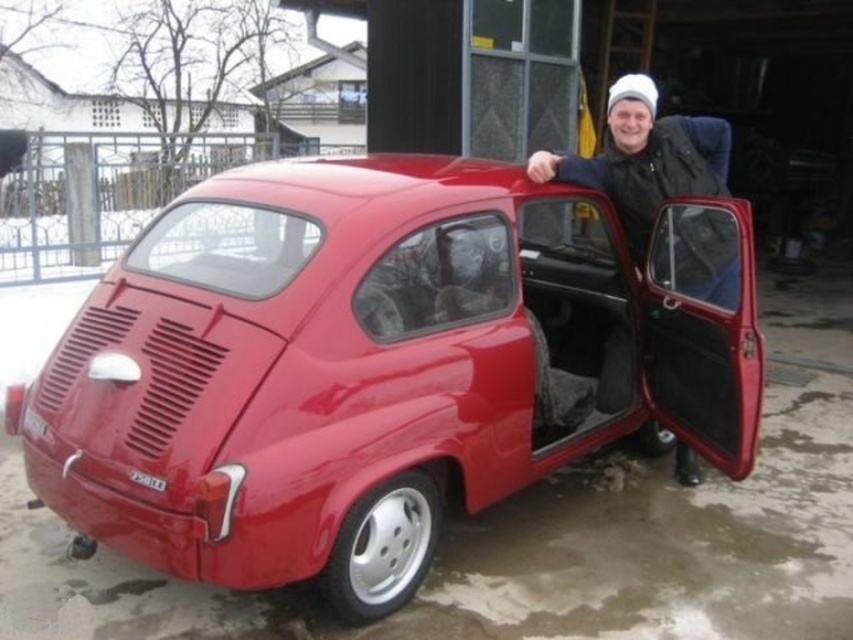
You are a delivery person trying to park your van in the residential area shown. The parking spot is at coordinates 0.6, 0.4. Is the glossy red car at center blocking your parking spot?

The glossy red car at center is located at point (378, 365), which is very close to the parking spot at (340, 384). Depending on the exact dimensions and orientation of the car and parking spot, it might be blocking access. However, since the car is parked and you can maneuver around it carefully, it might not completely block the spot. Proceed with caution and check the space carefully before attempting to park.